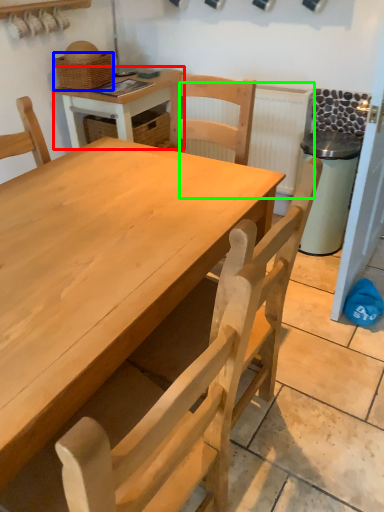
Question: Based on their relative distances, which object is farther from table (highlighted by a red box)? Choose from basket (highlighted by a blue box) and radiator (highlighted by a green box).

Choices:
 (A) basket
 (B) radiator

Answer: (B)